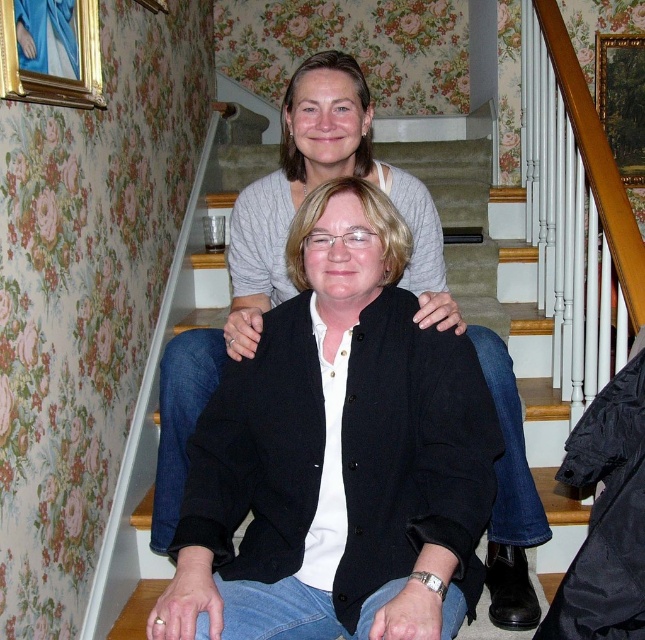
Question: Is wooden staircase at center behind wooden picture frame at upper right?

Choices:
 (A) yes
 (B) no

Answer: (B)

Question: Is the position of wooden staircase at center more distant than that of gold-framed painting at upper left?

Choices:
 (A) yes
 (B) no

Answer: (A)

Question: Based on their relative distances, which object is nearer to the gold-framed painting at upper left?

Choices:
 (A) wooden staircase at center
 (B) wooden picture frame at upper right

Answer: (A)

Question: Considering the real-world distances, which object is farthest from the gold-framed painting at upper left?

Choices:
 (A) wooden staircase at center
 (B) wooden picture frame at upper right

Answer: (B)

Question: Which of the following is the closest to the observer?

Choices:
 (A) wooden staircase at center
 (B) wooden picture frame at upper right
 (C) gold-framed painting at upper left

Answer: (C)

Question: Does gold-framed painting at upper left have a greater width compared to wooden picture frame at upper right?

Choices:
 (A) no
 (B) yes

Answer: (A)